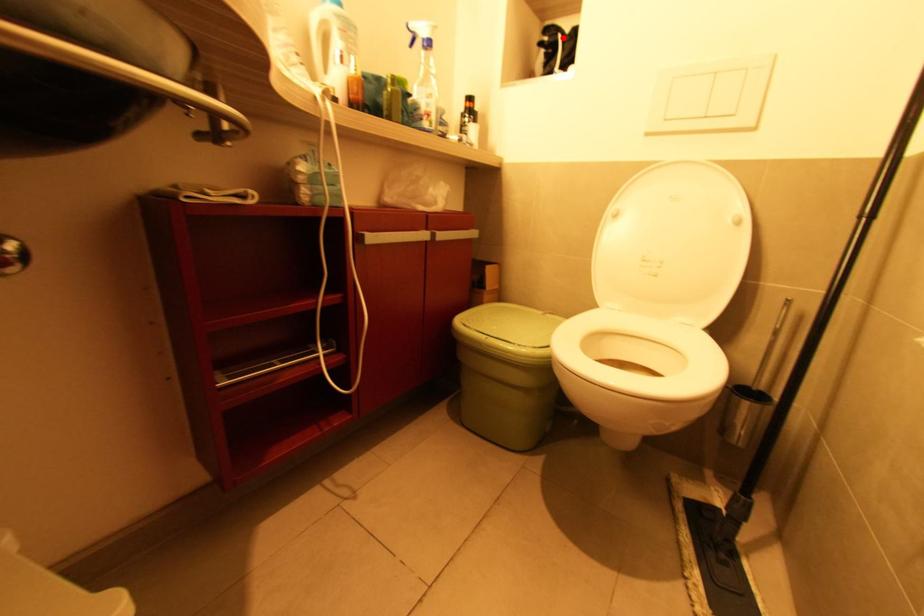
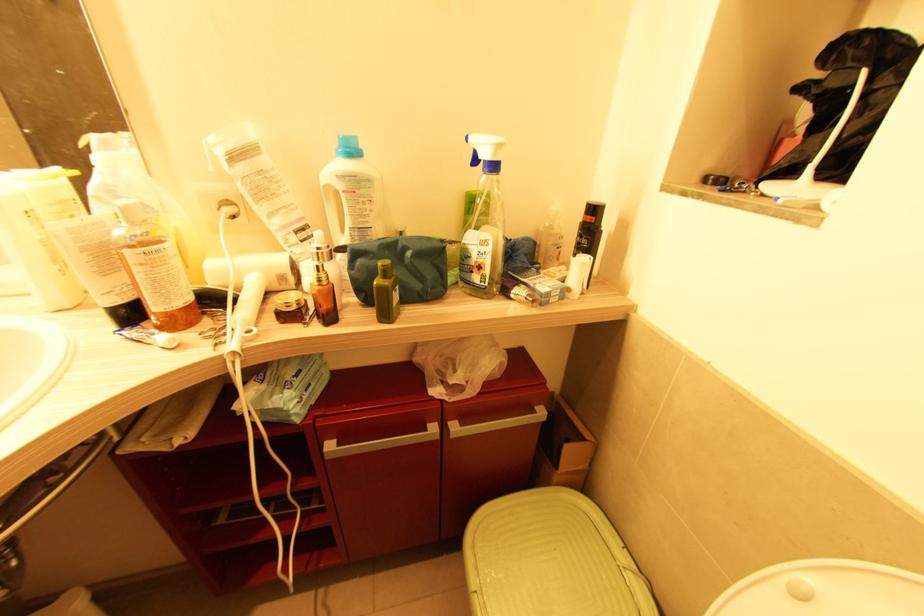
In the second image, find the point that corresponds to the highlighted location in the first image.

(867, 73)